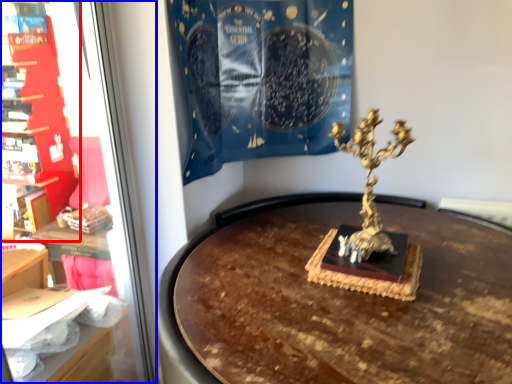
Question: Which object is further to the camera taking this photo, furniture (highlighted by a red box) or shop window (highlighted by a blue box)?

Choices:
 (A) furniture
 (B) shop window

Answer: (A)